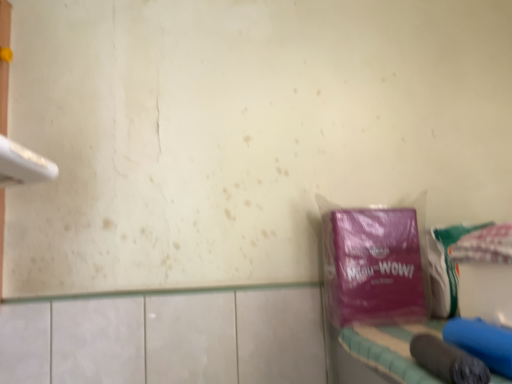
The height and width of the screenshot is (384, 512). What do you see at coordinates (373, 266) in the screenshot?
I see `purple matte plastic bag at right` at bounding box center [373, 266].

Locate an element on the screen. Image resolution: width=512 pixels, height=384 pixels. purple matte plastic bag at right is located at coordinates (373, 266).

Describe the element at coordinates (391, 349) in the screenshot. I see `blue fabric vanity at lower right` at that location.

Image resolution: width=512 pixels, height=384 pixels. Identify the location of blue fabric vanity at lower right. click(x=391, y=349).

Measure the distance between blue fabric vanity at lower right and camera.

blue fabric vanity at lower right and camera are 19.25 inches apart from each other.

I want to click on purple matte plastic bag at right, so click(x=373, y=266).

Which object is positioned more to the right, purple matte plastic bag at right or blue fabric vanity at lower right?

Positioned to the right is blue fabric vanity at lower right.

Which object is further away from the camera taking this photo, purple matte plastic bag at right or blue fabric vanity at lower right?

Positioned behind is purple matte plastic bag at right.

Does point (341, 314) appear closer or farther from the camera than point (401, 364)?

Point (341, 314) is positioned farther from the camera compared to point (401, 364).

From the image's perspective, is purple matte plastic bag at right below blue fabric vanity at lower right?

No, from the image's perspective, purple matte plastic bag at right is not below blue fabric vanity at lower right.

From a real-world perspective, is purple matte plastic bag at right on blue fabric vanity at lower right?

Yes, from a real-world perspective, purple matte plastic bag at right is over blue fabric vanity at lower right

Considering the sizes of objects purple matte plastic bag at right and blue fabric vanity at lower right in the image provided, who is thinner, purple matte plastic bag at right or blue fabric vanity at lower right?

purple matte plastic bag at right.

Between purple matte plastic bag at right and blue fabric vanity at lower right, which one has less height?

blue fabric vanity at lower right.

Which of these two, purple matte plastic bag at right or blue fabric vanity at lower right, is smaller?

purple matte plastic bag at right is smaller.

Could blue fabric vanity at lower right be considered to be inside purple matte plastic bag at right?

No, blue fabric vanity at lower right is not a part of purple matte plastic bag at right.

Is purple matte plastic bag at right touching blue fabric vanity at lower right?

purple matte plastic bag at right is not next to blue fabric vanity at lower right, and they're not touching.

Is purple matte plastic bag at right oriented away from blue fabric vanity at lower right?

No, blue fabric vanity at lower right is not at the back of purple matte plastic bag at right.

How distant is purple matte plastic bag at right from blue fabric vanity at lower right?

purple matte plastic bag at right is 5.07 inches from blue fabric vanity at lower right.

You are a GUI agent. You are given a task and a screenshot of the screen. Output one action in this format:
    pyautogui.click(x=<x>, y=<y>)
    Task: Click on the plastic bag behind the blue fabric vanity at lower right
    The height and width of the screenshot is (384, 512).
    Given the screenshot: What is the action you would take?
    pyautogui.click(x=373, y=266)

Between blue fabric vanity at lower right and purple matte plastic bag at right, which one appears on the right side from the viewer's perspective?

blue fabric vanity at lower right.

Does blue fabric vanity at lower right lie in front of purple matte plastic bag at right?

Yes, it is in front of purple matte plastic bag at right.

Which is in front, point (407, 342) or point (384, 279)?

Positioned in front is point (407, 342).

From the image's perspective, which object appears higher, blue fabric vanity at lower right or purple matte plastic bag at right?

purple matte plastic bag at right appears higher in the image.

From a real-world perspective, does blue fabric vanity at lower right sit lower than purple matte plastic bag at right?

Yes, from a real-world perspective, blue fabric vanity at lower right is under purple matte plastic bag at right.

Which of these two, blue fabric vanity at lower right or purple matte plastic bag at right, is thinner?

With smaller width is purple matte plastic bag at right.

Between blue fabric vanity at lower right and purple matte plastic bag at right, which one has less height?

Standing shorter between the two is blue fabric vanity at lower right.

Which of these two, blue fabric vanity at lower right or purple matte plastic bag at right, is bigger?

With larger size is blue fabric vanity at lower right.

From the picture: Could purple matte plastic bag at right be considered to be inside blue fabric vanity at lower right?

No, purple matte plastic bag at right is not inside blue fabric vanity at lower right.

Is blue fabric vanity at lower right next to purple matte plastic bag at right?

No.

Is blue fabric vanity at lower right positioned with its back to purple matte plastic bag at right?

That's right, blue fabric vanity at lower right is facing away from purple matte plastic bag at right.

Can you tell me how much blue fabric vanity at lower right and purple matte plastic bag at right differ in facing direction?

The angle between the facing direction of blue fabric vanity at lower right and the facing direction of purple matte plastic bag at right is 0.318 degrees.

Locate an element on the screen. This screenshot has width=512, height=384. vanity directly beneath the purple matte plastic bag at right (from a real-world perspective) is located at coordinates (x=391, y=349).

I want to click on plastic bag above the blue fabric vanity at lower right (from the image's perspective), so (373, 266).

Where is `vanity that appears on the right of purple matte plastic bag at right`? Image resolution: width=512 pixels, height=384 pixels. vanity that appears on the right of purple matte plastic bag at right is located at coordinates (391, 349).